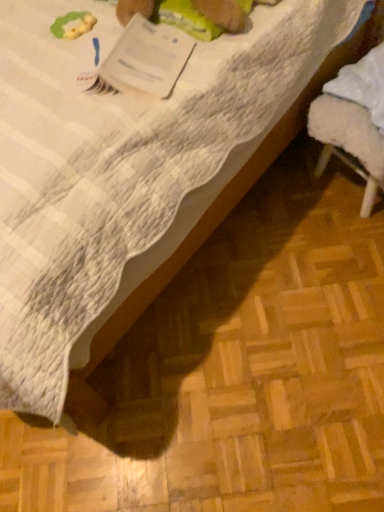
Describe the element at coordinates (146, 59) in the screenshot. The image size is (384, 512). I see `white paper at upper left` at that location.

The width and height of the screenshot is (384, 512). What are the coordinates of `white paper at upper left` in the screenshot? It's located at (146, 59).

This screenshot has height=512, width=384. Describe the element at coordinates (353, 122) in the screenshot. I see `white fluffy stool at lower right` at that location.

Measure the distance between white fluffy stool at lower right and camera.

A distance of 37.54 inches exists between white fluffy stool at lower right and camera.

I want to click on white fluffy stool at lower right, so click(353, 122).

What is the approximate width of white fluffy stool at lower right?

white fluffy stool at lower right is 6.53 inches wide.

Locate an element on the screen. white paper at upper left is located at coordinates (146, 59).

Can you confirm if white fluffy stool at lower right is positioned to the left of white paper at upper left?

Incorrect, white fluffy stool at lower right is not on the left side of white paper at upper left.

Is white fluffy stool at lower right behind white paper at upper left?

Yes, white fluffy stool at lower right is further from the camera.

Considering the points (363, 95) and (160, 28), which point is behind, point (363, 95) or point (160, 28)?

The point (363, 95) is behind.

From the image's perspective, is white fluffy stool at lower right located beneath white paper at upper left?

Indeed, from the image's perspective, white fluffy stool at lower right is shown beneath white paper at upper left.

From a real-world perspective, is white fluffy stool at lower right above or below white paper at upper left?

From a real-world perspective, white fluffy stool at lower right is physically below white paper at upper left.

Between white fluffy stool at lower right and white paper at upper left, which one has smaller width?

Thinner between the two is white fluffy stool at lower right.

Can you confirm if white fluffy stool at lower right is taller than white paper at upper left?

Correct, white fluffy stool at lower right is much taller as white paper at upper left.

Who is bigger, white fluffy stool at lower right or white paper at upper left?

white fluffy stool at lower right.

Which is correct: white fluffy stool at lower right is inside white paper at upper left, or outside of it?

white fluffy stool at lower right lies outside white paper at upper left.

Would you say white fluffy stool at lower right is a long distance from white paper at upper left?

No, white fluffy stool at lower right is not far away from white paper at upper left.

Is white fluffy stool at lower right oriented away from white paper at upper left?

No, white fluffy stool at lower right's orientation is not away from white paper at upper left.

Find the location of a particular element. Image resolution: width=384 pixels, height=512 pixels. furniture lying behind the white paper at upper left is located at coordinates (353, 122).

Considering the positions of objects white paper at upper left and white fluffy stool at lower right in the image provided, who is more to the right, white paper at upper left or white fluffy stool at lower right?

From the viewer's perspective, white fluffy stool at lower right appears more on the right side.

Considering the positions of objects white paper at upper left and white fluffy stool at lower right in the image provided, who is behind, white paper at upper left or white fluffy stool at lower right?

white fluffy stool at lower right is further away from the camera.

Consider the image. Which is closer to the camera, (143, 52) or (382, 168)?

Point (143, 52) is closer to the camera than point (382, 168).

From the image's perspective, is white paper at upper left located above or below white fluffy stool at lower right?

From the image's perspective, white paper at upper left appears above white fluffy stool at lower right.

From a real-world perspective, which object rests below the other?

From a 3D spatial view, white fluffy stool at lower right is below.

Considering the sizes of objects white paper at upper left and white fluffy stool at lower right in the image provided, who is wider, white paper at upper left or white fluffy stool at lower right?

white paper at upper left.

Consider the image. Does white paper at upper left have a greater height compared to white fluffy stool at lower right?

In fact, white paper at upper left may be shorter than white fluffy stool at lower right.

Considering the sizes of objects white paper at upper left and white fluffy stool at lower right in the image provided, who is smaller, white paper at upper left or white fluffy stool at lower right?

Smaller between the two is white paper at upper left.

Is white paper at upper left spatially inside white fluffy stool at lower right, or outside of it?

white paper at upper left is outside white fluffy stool at lower right.

Is white paper at upper left far from white fluffy stool at lower right?

Actually, white paper at upper left and white fluffy stool at lower right are a little close together.

Could you tell me if white paper at upper left is turned towards white fluffy stool at lower right?

No, white paper at upper left is not turned towards white fluffy stool at lower right.

What's the angular difference between white paper at upper left and white fluffy stool at lower right's facing directions?

They differ by 36.8 degrees in their facing directions.

The image size is (384, 512). In order to click on furniture lying on the right of white paper at upper left in this screenshot , I will do `click(353, 122)`.

Identify the location of furniture that appears below the white paper at upper left (from a real-world perspective). (353, 122).

Where is `furniture located behind the white paper at upper left`? This screenshot has height=512, width=384. furniture located behind the white paper at upper left is located at coordinates (353, 122).